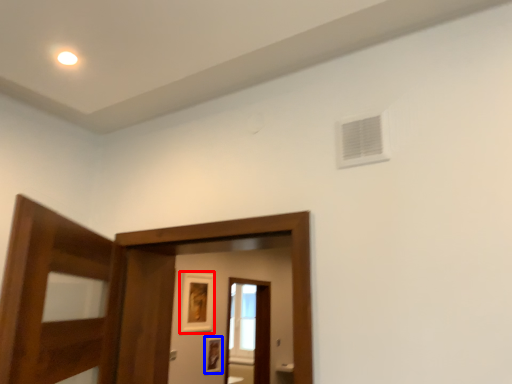
Question: Among these objects, which one is nearest to the camera, picture frame (highlighted by a red box) or picture frame (highlighted by a blue box)?

Choices:
 (A) picture frame
 (B) picture frame

Answer: (A)